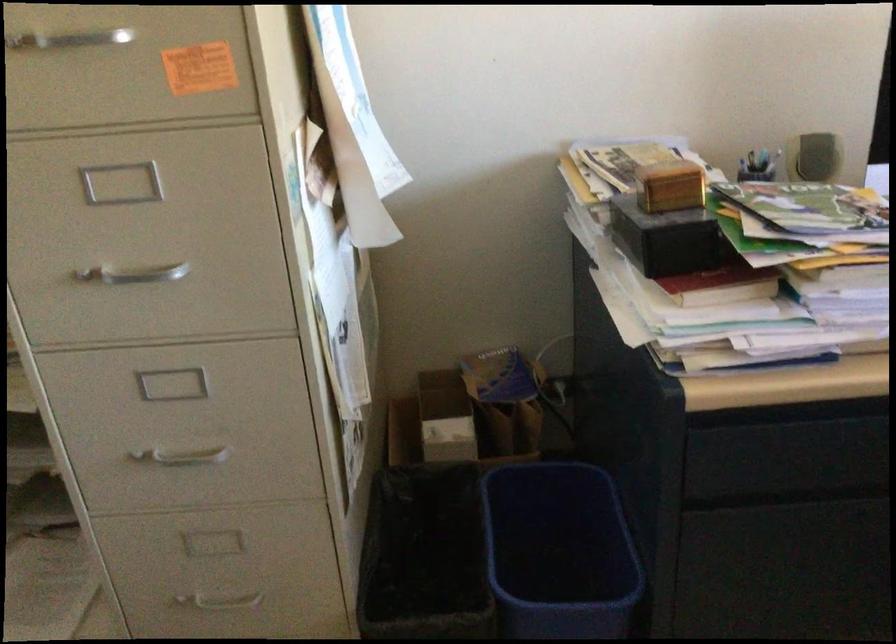
Which object does [669,185] point to?

It refers to a small golden box.